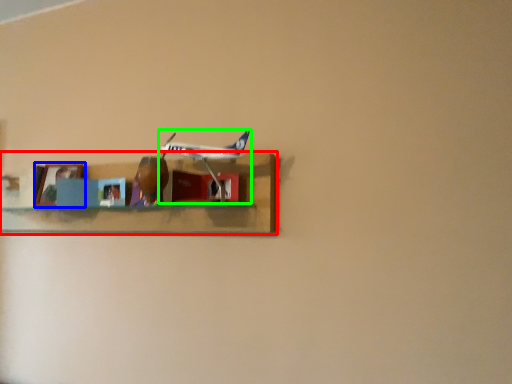
Question: Considering the real-world distances, which object is closest to shelf (highlighted by a red box)? picture frame (highlighted by a blue box) or airplane (highlighted by a green box).

Choices:
 (A) picture frame
 (B) airplane

Answer: (B)